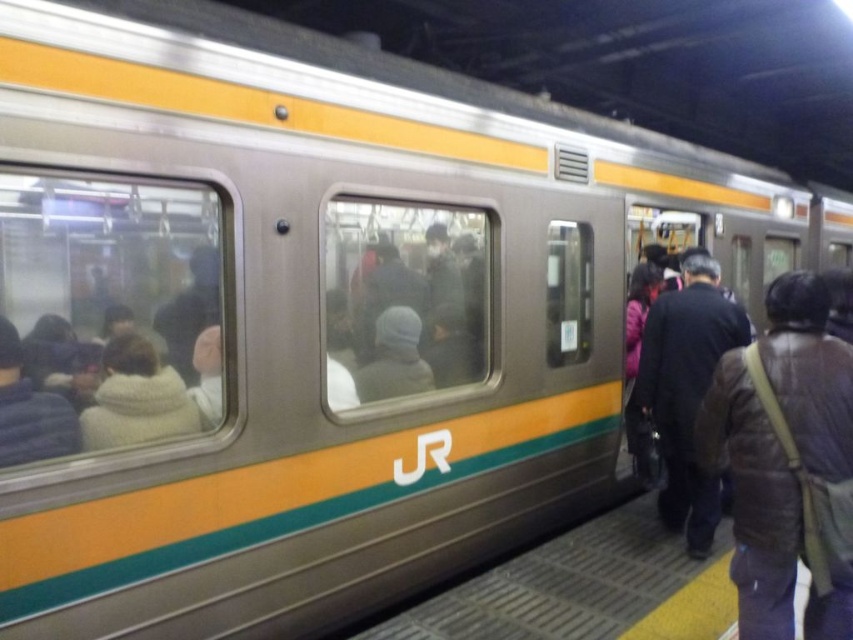
You are a commuter in a train station and you see two jackets on the platform. The brown leather jacket at lower right and the dark brown leather jacket at right. Which jacket is closer to you?

The brown leather jacket at lower right is closer to you because it is in front of the dark brown leather jacket at right.

You are a commuter rushing to catch the train and notice two jackets on the platform. The brown leather jacket at lower right and the dark brown leather jacket at right are both unattended. Which jacket is closer to the edge of the platform where the train doors are open?

The brown leather jacket at lower right is to the left of the dark brown leather jacket at right, so the dark brown leather jacket at right is closer to the edge of the platform where the train doors are open.

You are a commuter in a crowded train station. You notice two jackets hanging on a hook near the train doors. One is a brown leather jacket at lower right and the other is a dark brown leather jacket at right. Which jacket is closer to the ground?

Result: The brown leather jacket at lower right is closer to the ground because it is positioned under the dark brown leather jacket at right.